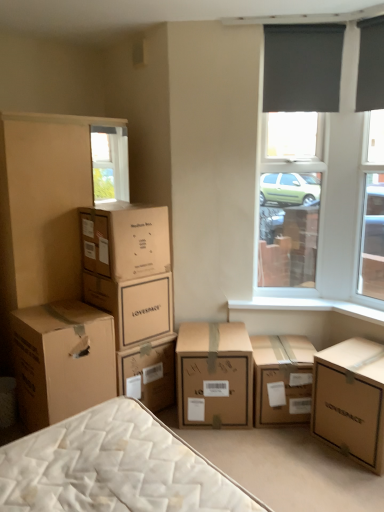
Where is `empty space that is ontop of brown cardboard box at center, acting as the second box starting from the right (from a real-world perspective)`? empty space that is ontop of brown cardboard box at center, acting as the second box starting from the right (from a real-world perspective) is located at coordinates (279, 347).